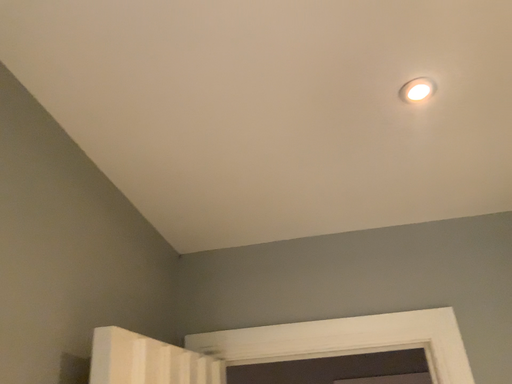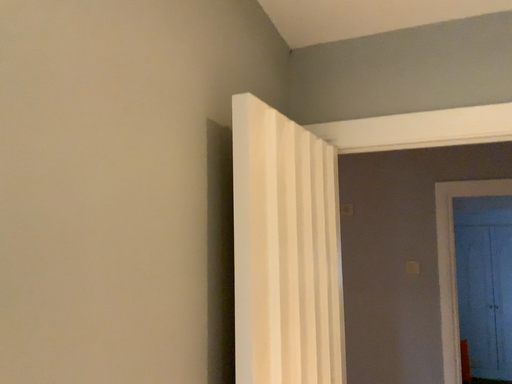
Question: How did the camera likely rotate when shooting the video?

Choices:
 (A) rotated upward
 (B) rotated downward

Answer: (B)